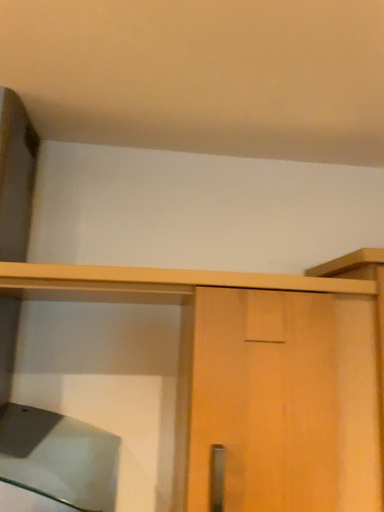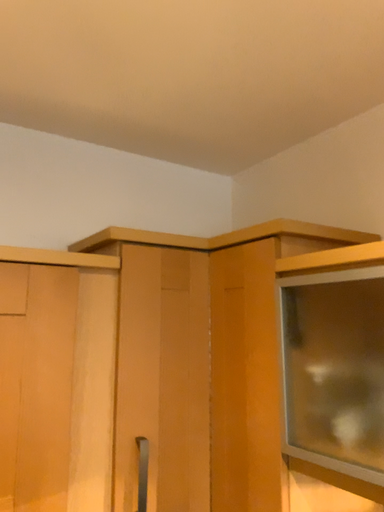
Question: How did the camera likely rotate when shooting the video?

Choices:
 (A) rotated left
 (B) rotated right

Answer: (B)